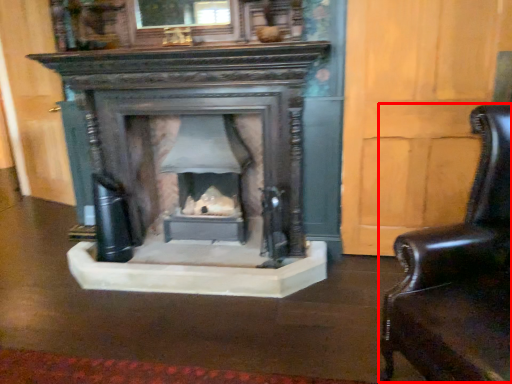
Question: Where is swivel chair (annotated by the red box) located in relation to fireplace in the image?

Choices:
 (A) right
 (B) left

Answer: (A)